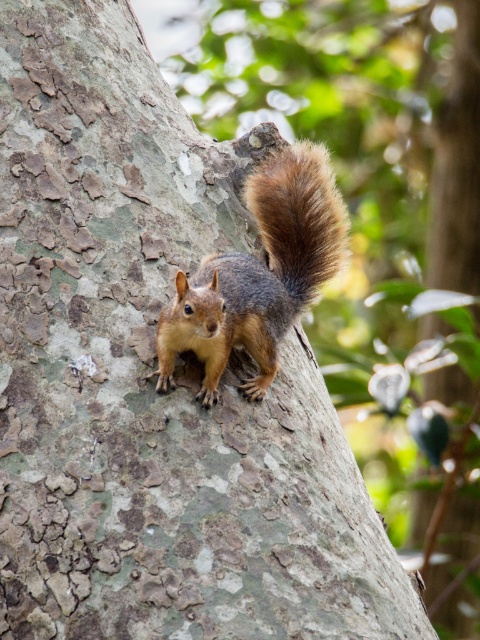
You are a photographer trying to capture the shiny brown fur squirrel at center and the fuzzy brown tail at upper right in a single shot. Based on their positions, which one is closer to the camera?

The shiny brown fur squirrel at center is closer to the camera because it is located below the fuzzy brown tail at upper right, which suggests it is positioned in front of the tail.

You are a photographer trying to capture the shiny brown fur squirrel at center and the fuzzy brown tail at upper right in a single shot. Which object should you focus on first if you want to ensure both are in focus, considering their sizes?

The shiny brown fur squirrel at center is bigger than the fuzzy brown tail at upper right, so you should focus on the shiny brown fur squirrel at center first to ensure both are in focus.